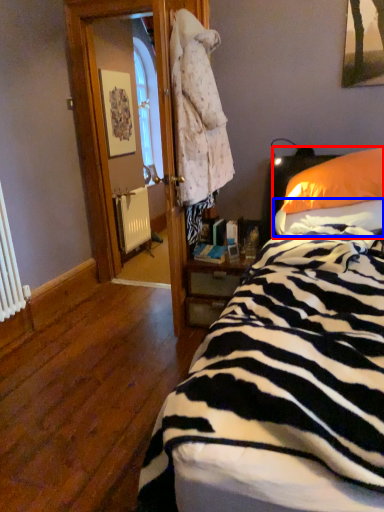
Question: Among these objects, which one is nearest to the camera, pillow (highlighted by a red box) or sheet (highlighted by a blue box)?

Choices:
 (A) pillow
 (B) sheet

Answer: (B)